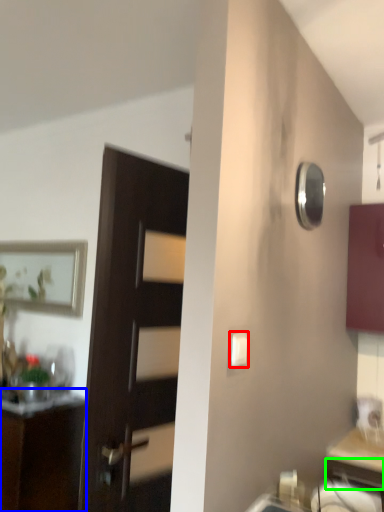
Question: Which is nearer to the light switch (highlighted by a red box)? cabinetry (highlighted by a blue box) or drawer (highlighted by a green box).

Choices:
 (A) cabinetry
 (B) drawer

Answer: (B)